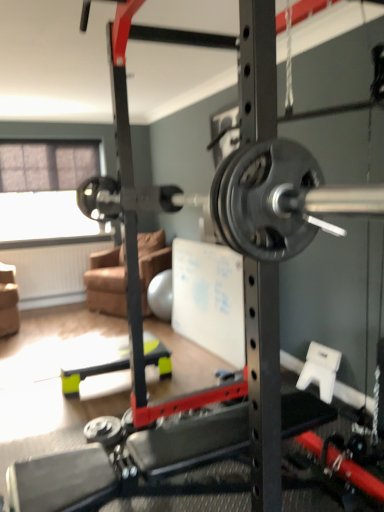
Question: Is brown fabric couch at center shorter than transparent fabric at left?

Choices:
 (A) no
 (B) yes

Answer: (B)

Question: From the image's perspective, is brown fabric couch at center beneath transparent fabric at left?

Choices:
 (A) yes
 (B) no

Answer: (A)

Question: Can you confirm if brown fabric couch at center is taller than transparent fabric at left?

Choices:
 (A) yes
 (B) no

Answer: (B)

Question: Does brown fabric couch at center have a greater width compared to transparent fabric at left?

Choices:
 (A) no
 (B) yes

Answer: (B)

Question: Is the position of brown fabric couch at center more distant than that of transparent fabric at left?

Choices:
 (A) yes
 (B) no

Answer: (B)

Question: From a real-world perspective, is brown fabric couch at center located beneath transparent fabric at left?

Choices:
 (A) yes
 (B) no

Answer: (A)

Question: Is transparent fabric at left wider than brown fabric couch at center?

Choices:
 (A) yes
 (B) no

Answer: (B)

Question: Are transparent fabric at left and brown fabric couch at center located far from each other?

Choices:
 (A) yes
 (B) no

Answer: (B)

Question: Is brown fabric couch at center located within transparent fabric at left?

Choices:
 (A) no
 (B) yes

Answer: (A)

Question: Is transparent fabric at left smaller than brown fabric couch at center?

Choices:
 (A) yes
 (B) no

Answer: (A)

Question: Does transparent fabric at left have a greater height compared to brown fabric couch at center?

Choices:
 (A) no
 (B) yes

Answer: (B)

Question: From the image's perspective, is transparent fabric at left under brown fabric couch at center?

Choices:
 (A) no
 (B) yes

Answer: (A)

Question: Which is correct: brown fabric couch at center is inside transparent fabric at left, or outside of it?

Choices:
 (A) outside
 (B) inside

Answer: (A)